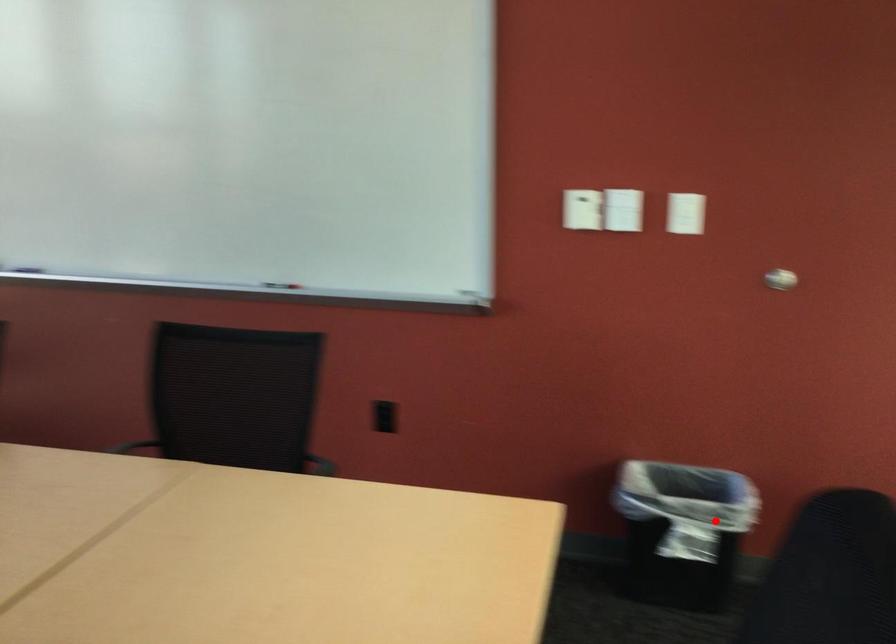
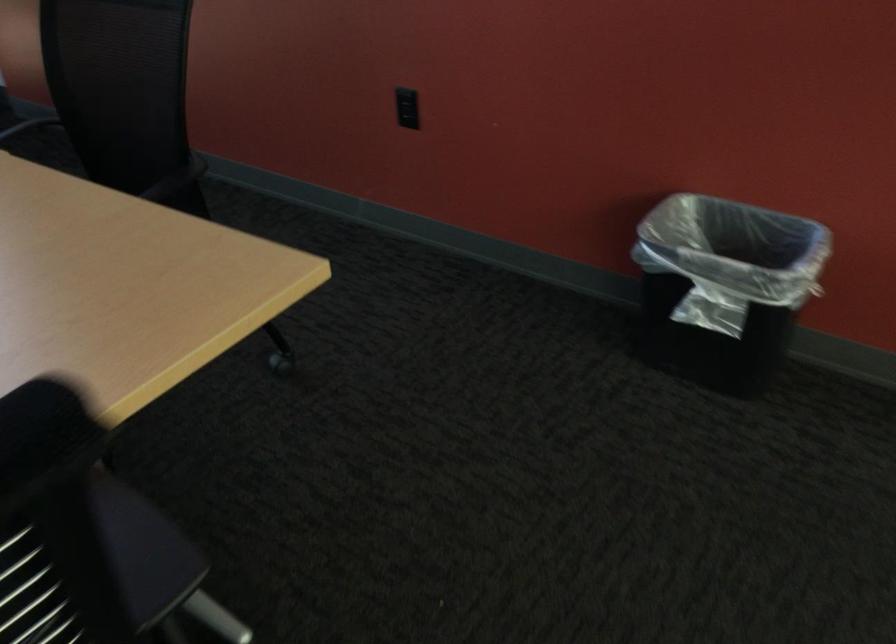
Where in the second image is the point corresponding to the highlighted location from the first image?

(725, 287)